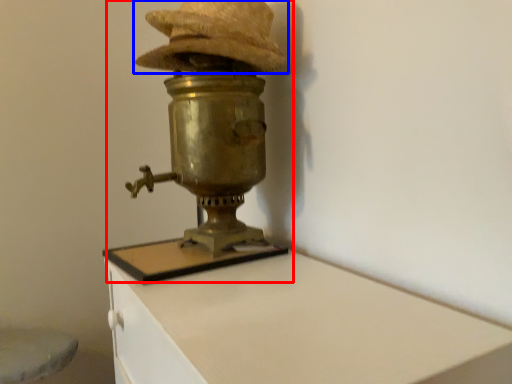
Question: Which object is further to the camera taking this photo, table lamp (highlighted by a red box) or hat (highlighted by a blue box)?

Choices:
 (A) table lamp
 (B) hat

Answer: (B)